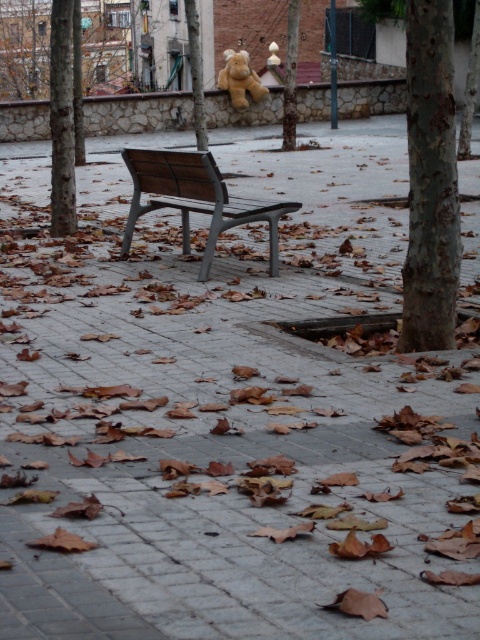
Based on the photo, can you confirm if smooth brown tree trunk at left is positioned above soft plush bear at upper center?

Actually, smooth brown tree trunk at left is below soft plush bear at upper center.

Which is more to the right, smooth brown tree trunk at left or soft plush bear at upper center?

Positioned to the right is soft plush bear at upper center.

Between point (72, 1) and point (248, 72), which one is positioned in front?

Positioned in front is point (72, 1).

In order to click on smooth brown tree trunk at left in this screenshot , I will do `click(61, 120)`.

Can you confirm if rough bark tree at right is smaller than wooden bench at center?

Yes, rough bark tree at right is smaller than wooden bench at center.

Identify the location of rough bark tree at right. The width and height of the screenshot is (480, 640). (431, 180).

Which is in front, point (430, 262) or point (276, 211)?

Point (430, 262)

Find the location of a particular element. The image size is (480, 640). rough bark tree at right is located at coordinates (431, 180).

Is wooden bench at center closer to camera compared to smooth brown tree trunk at left?

Yes, wooden bench at center is in front of smooth brown tree trunk at left.

Which of these two, wooden bench at center or smooth brown tree trunk at left, stands taller?

wooden bench at center

Is point (273, 253) closer to viewer compared to point (69, 17)?

Yes.

The image size is (480, 640). I want to click on wooden bench at center, so click(x=195, y=198).